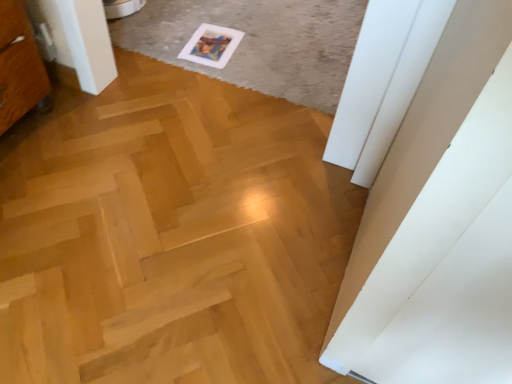
Question: Is white paper postcard at upper center smaller than natural wood plywood at center?

Choices:
 (A) no
 (B) yes

Answer: (B)

Question: From the image's perspective, would you say white paper postcard at upper center is shown under natural wood plywood at center?

Choices:
 (A) no
 (B) yes

Answer: (A)

Question: Considering the relative sizes of white paper postcard at upper center and natural wood plywood at center in the image provided, is white paper postcard at upper center taller than natural wood plywood at center?

Choices:
 (A) no
 (B) yes

Answer: (A)

Question: Does white paper postcard at upper center appear on the right side of natural wood plywood at center?

Choices:
 (A) no
 (B) yes

Answer: (B)

Question: Can we say white paper postcard at upper center lies outside natural wood plywood at center?

Choices:
 (A) yes
 (B) no

Answer: (A)

Question: Considering the positions of point (170, 8) and point (226, 51), is point (170, 8) closer or farther from the camera than point (226, 51)?

Choices:
 (A) farther
 (B) closer

Answer: (A)

Question: Is white paper at upper center in front of or behind white paper postcard at upper center in the image?

Choices:
 (A) front
 (B) behind

Answer: (A)

Question: In terms of size, does white paper at upper center appear bigger or smaller than white paper postcard at upper center?

Choices:
 (A) small
 (B) big

Answer: (B)

Question: Would you say white paper at upper center is inside or outside white paper postcard at upper center?

Choices:
 (A) inside
 (B) outside

Answer: (B)

Question: Is point (114, 185) positioned closer to the camera than point (125, 16)?

Choices:
 (A) farther
 (B) closer

Answer: (B)

Question: Is natural wood plywood at center situated inside white paper at upper center or outside?

Choices:
 (A) outside
 (B) inside

Answer: (A)

Question: In terms of width, does natural wood plywood at center look wider or thinner when compared to white paper at upper center?

Choices:
 (A) wide
 (B) thin

Answer: (A)

Question: From a real-world perspective, relative to white paper at upper center, is natural wood plywood at center vertically above or below?

Choices:
 (A) below
 (B) above

Answer: (A)

Question: Is white paper postcard at upper center in front of or behind white paper at upper center in the image?

Choices:
 (A) front
 (B) behind

Answer: (B)

Question: From a real-world perspective, is white paper postcard at upper center physically located above or below white paper at upper center?

Choices:
 (A) below
 (B) above

Answer: (A)